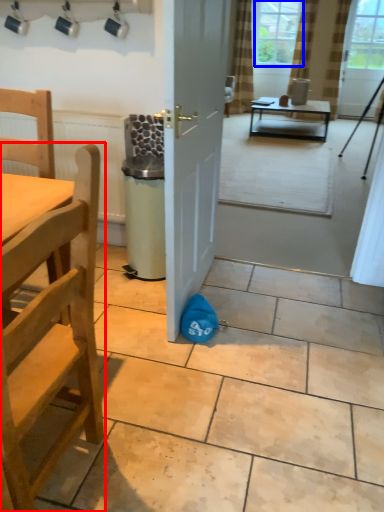
Question: Which object is further to the camera taking this photo, chair (highlighted by a red box) or window screen (highlighted by a blue box)?

Choices:
 (A) chair
 (B) window screen

Answer: (B)